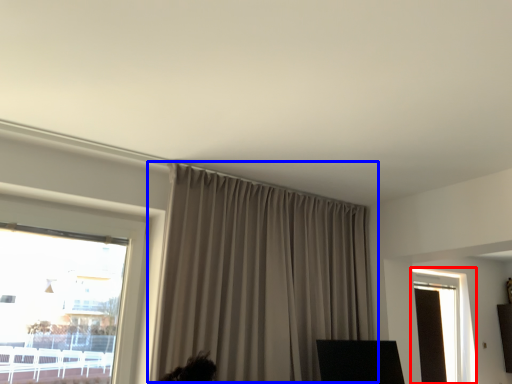
Question: Which point is further to the camera, window (highlighted by a red box) or curtain (highlighted by a blue box)?

Choices:
 (A) window
 (B) curtain

Answer: (A)